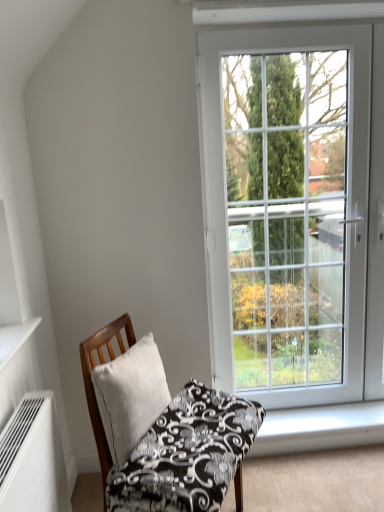
What do you see at coordinates (33, 458) in the screenshot? I see `white matte air conditioner at lower left` at bounding box center [33, 458].

This screenshot has height=512, width=384. What do you see at coordinates (320, 428) in the screenshot?
I see `white smooth window sill at lower right` at bounding box center [320, 428].

Locate an element on the screen. This screenshot has width=384, height=512. white glass door at upper right is located at coordinates (288, 225).

The height and width of the screenshot is (512, 384). Describe the element at coordinates (162, 430) in the screenshot. I see `wooden chair with patterned cushion at lower left` at that location.

Identify the location of white matte air conditioner at lower left. (33, 458).

From a real-world perspective, is wooden chair with patterned cushion at lower left positioned under white glass door at upper right based on gravity?

Yes.

Looking at this image, could you tell me if wooden chair with patterned cushion at lower left is turned towards white glass door at upper right?

No, wooden chair with patterned cushion at lower left is not facing towards white glass door at upper right.

Considering the sizes of objects wooden chair with patterned cushion at lower left and white glass door at upper right in the image provided, who is thinner, wooden chair with patterned cushion at lower left or white glass door at upper right?

white glass door at upper right is thinner.

Is white smooth window sill at lower right taller or shorter than white glass door at upper right?

Considering their sizes, white smooth window sill at lower right has less height than white glass door at upper right.

Is white smooth window sill at lower right inside the boundaries of white glass door at upper right, or outside?

white smooth window sill at lower right is not inside white glass door at upper right, it's outside.

Is point (315, 414) positioned behind point (326, 314)?

No, it is in front of (326, 314).

What's the angular difference between white smooth window sill at lower right and white glass door at upper right's facing directions?

They differ by 0.878 degrees in their facing directions.

Considering the sizes of objects white glass door at upper right and wooden chair with patterned cushion at lower left in the image provided, who is bigger, white glass door at upper right or wooden chair with patterned cushion at lower left?

white glass door at upper right is bigger.

From the image's perspective, would you say white glass door at upper right is shown under wooden chair with patterned cushion at lower left?

No, from the image's perspective, white glass door at upper right is not beneath wooden chair with patterned cushion at lower left.

Considering the relative sizes of white glass door at upper right and wooden chair with patterned cushion at lower left in the image provided, is white glass door at upper right thinner than wooden chair with patterned cushion at lower left?

Indeed, white glass door at upper right has a lesser width compared to wooden chair with patterned cushion at lower left.

Which is in front, point (242, 334) or point (160, 461)?

Point (160, 461)

Between point (136, 345) and point (287, 444), which one is positioned behind?

The point (287, 444) is behind.

Between wooden chair with patterned cushion at lower left and white smooth window sill at lower right, which one has less height?

white smooth window sill at lower right is shorter.

Is wooden chair with patterned cushion at lower left far away from white smooth window sill at lower right?

That's not correct — wooden chair with patterned cushion at lower left is a little close to white smooth window sill at lower right.

Relative to white smooth window sill at lower right, is wooden chair with patterned cushion at lower left in front or behind?

In the image, wooden chair with patterned cushion at lower left appears in front of white smooth window sill at lower right.

Would you consider white smooth window sill at lower right to be distant from wooden chair with patterned cushion at lower left?

No, there isn't a large distance between white smooth window sill at lower right and wooden chair with patterned cushion at lower left.

Considering the relative sizes of white smooth window sill at lower right and wooden chair with patterned cushion at lower left in the image provided, is white smooth window sill at lower right shorter than wooden chair with patterned cushion at lower left?

Indeed, white smooth window sill at lower right has a lesser height compared to wooden chair with patterned cushion at lower left.

Could you measure the distance between white smooth window sill at lower right and wooden chair with patterned cushion at lower left?

31.76 inches.

Considering the points (274, 412) and (190, 488), which point is behind, point (274, 412) or point (190, 488)?

The point (274, 412) is behind.

Is white glass door at upper right located within white matte shelf at upper left?

No, white glass door at upper right is not surrounded by white matte shelf at upper left.

From the image's perspective, would you say white matte shelf at upper left is positioned over white glass door at upper right?

No, from the image's perspective, white matte shelf at upper left is not over white glass door at upper right.

From a real-world perspective, between white matte shelf at upper left and white glass door at upper right, who is vertically lower?

white matte shelf at upper left is physically lower.

Does point (15, 449) lie in front of point (304, 42)?

Yes.

Looking at this image, how different are the orientations of white matte air conditioner at lower left and white glass door at upper right in degrees?

90.1 degrees separate the facing orientations of white matte air conditioner at lower left and white glass door at upper right.

Could white glass door at upper right be considered to be inside white matte air conditioner at lower left?

No, white glass door at upper right is located outside of white matte air conditioner at lower left.

Looking at this image, from a real-world perspective, between white matte air conditioner at lower left and white glass door at upper right, who is vertically lower?

From a 3D spatial view, white matte air conditioner at lower left is below.

Image resolution: width=384 pixels, height=512 pixels. Identify the location of window that is on the right side of wooden chair with patterned cushion at lower left. (288, 225).

The width and height of the screenshot is (384, 512). I want to click on window sill located below the white glass door at upper right (from the image's perspective), so click(320, 428).

When comparing their distances from white glass door at upper right, does white smooth window sill at lower right or white matte air conditioner at lower left seem further?

Among the two, white matte air conditioner at lower left is located further to white glass door at upper right.

Looking at the image, which one is located further to white matte air conditioner at lower left, white glass door at upper right or white linen pillow at center?

white glass door at upper right lies further to white matte air conditioner at lower left than the other object.

Considering their positions, is white linen pillow at center positioned further to white glass door at upper right than white matte shelf at upper left?

white matte shelf at upper left is further to white glass door at upper right.

Which object lies further to the anchor point white glass door at upper right, white matte air conditioner at lower left or white smooth window sill at lower right?

white matte air conditioner at lower left is further to white glass door at upper right.

Based on their spatial positions, is white matte shelf at upper left or wooden chair with patterned cushion at lower left closer to white linen pillow at center?

The object closer to white linen pillow at center is wooden chair with patterned cushion at lower left.

Estimate the real-world distances between objects in this image. Which object is closer to white linen pillow at center, white smooth window sill at lower right or white matte shelf at upper left?

white matte shelf at upper left lies closer to white linen pillow at center than the other object.

Estimate the real-world distances between objects in this image. Which object is further from white smooth window sill at lower right, white matte shelf at upper left or wooden chair with patterned cushion at lower left?

white matte shelf at upper left lies further to white smooth window sill at lower right than the other object.

From the image, which object appears to be farther from white matte shelf at upper left, white smooth window sill at lower right or wooden chair with patterned cushion at lower left?

A: Based on the image, white smooth window sill at lower right appears to be further to white matte shelf at upper left.

Where is `air conditioner between white matte shelf at upper left and wooden chair with patterned cushion at lower left in the horizontal direction`? Image resolution: width=384 pixels, height=512 pixels. air conditioner between white matte shelf at upper left and wooden chair with patterned cushion at lower left in the horizontal direction is located at coordinates (33, 458).

Locate an element on the screen. chair between white matte shelf at upper left and white glass door at upper right in the horizontal direction is located at coordinates (162, 430).

You are a GUI agent. You are given a task and a screenshot of the screen. Output one action in this format:
    pyautogui.click(x=<x>, y=<y>)
    Task: Click on the chair between white matte shelf at upper left and white smooth window sill at lower right
    The height and width of the screenshot is (512, 384).
    Given the screenshot: What is the action you would take?
    pyautogui.click(x=162, y=430)

Locate an element on the screen. pillow between white glass door at upper right and wooden chair with patterned cushion at lower left in the up-down direction is located at coordinates (130, 396).